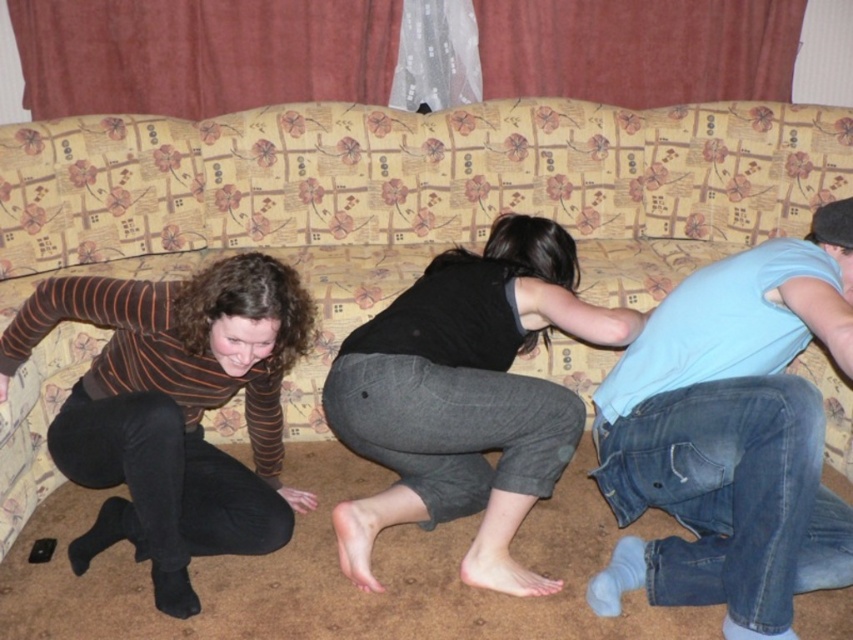
Question: Observing the image, what is the correct spatial positioning of blue denim jeans at lower right in reference to black matte pants at center?

Choices:
 (A) above
 (B) below

Answer: (A)

Question: Which of the following is the farthest from the observer?

Choices:
 (A) (148, 548)
 (B) (807, 387)
 (C) (426, 301)

Answer: (C)

Question: Does blue denim jeans at lower right appear over striped jersey at lower left?

Choices:
 (A) no
 (B) yes

Answer: (B)

Question: Which of these objects is positioned farthest from the black matte pants at center?

Choices:
 (A) striped jersey at lower left
 (B) blue denim jeans at lower right

Answer: (A)

Question: Is blue denim jeans at lower right thinner than black matte pants at center?

Choices:
 (A) yes
 (B) no

Answer: (A)

Question: Which object is farther from the camera taking this photo?

Choices:
 (A) striped jersey at lower left
 (B) black matte pants at center

Answer: (B)